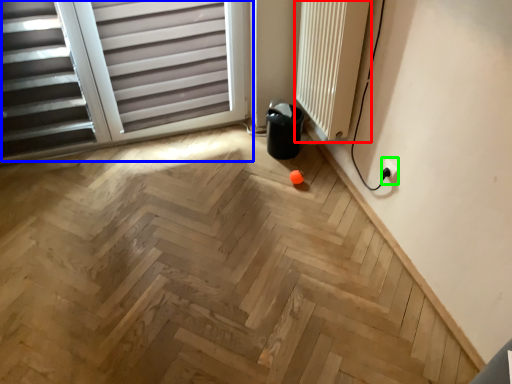
Question: Which is nearer to the radiator (highlighted by a red box)? window (highlighted by a blue box) or electric outlet (highlighted by a green box).

Choices:
 (A) window
 (B) electric outlet

Answer: (B)